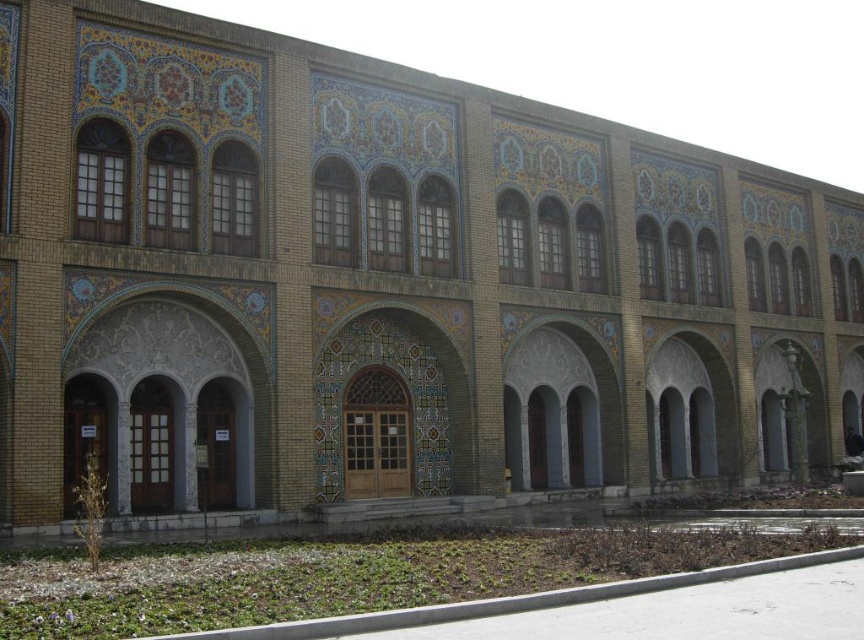
You are standing in front of the building and notice two archways at the center. Which archway is closer to you, the white stone archway at center or the gray stone archway at center?

The white stone archway at center is closer to you because it is in front of the gray stone archway at center.